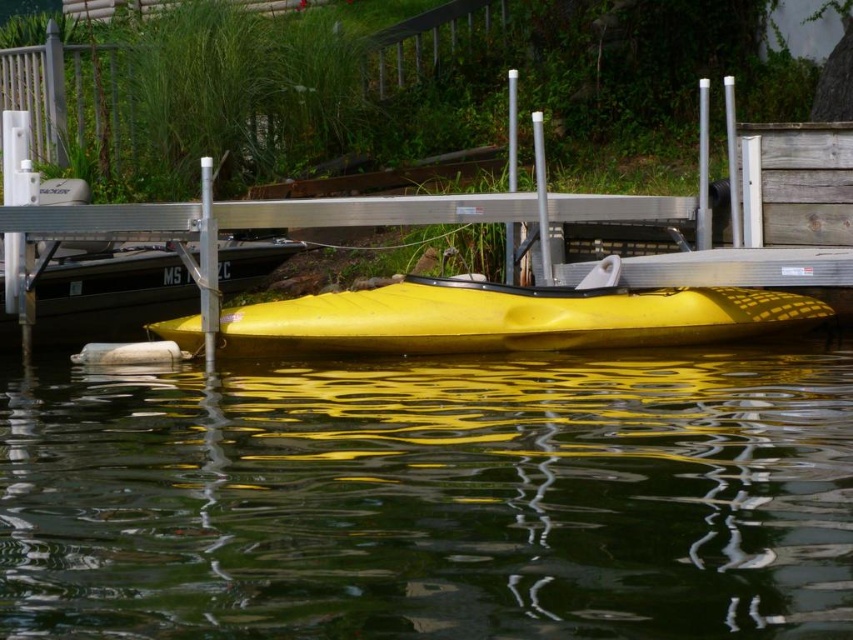
Question: Which point appears closest to the camera in this image?

Choices:
 (A) click(x=585, y=465)
 (B) click(x=357, y=305)

Answer: (A)

Question: Is glossy yellow kayak at center below yellow matte kayak at center?

Choices:
 (A) yes
 (B) no

Answer: (A)

Question: Is glossy yellow kayak at center behind yellow matte kayak at center?

Choices:
 (A) no
 (B) yes

Answer: (A)

Question: Is glossy yellow kayak at center bigger than yellow matte kayak at center?

Choices:
 (A) yes
 (B) no

Answer: (B)